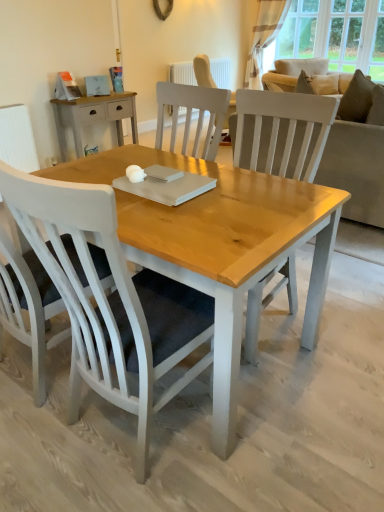
Question: Is white painted wood chair at left, the 1th chair viewed from the left, oriented away from light beige fabric couch at upper right?

Choices:
 (A) yes
 (B) no

Answer: (B)

Question: Is white painted wood chair at left, the 1th chair viewed from the left, positioned before light beige fabric couch at upper right?

Choices:
 (A) yes
 (B) no

Answer: (A)

Question: Is white painted wood chair at left, arranged as the 2th chair when viewed from the right, behind light beige fabric couch at upper right?

Choices:
 (A) yes
 (B) no

Answer: (B)

Question: From the image's perspective, would you say white painted wood chair at left, the 1th chair viewed from the left, is positioned over light beige fabric couch at upper right?

Choices:
 (A) yes
 (B) no

Answer: (B)

Question: Can you confirm if white painted wood chair at left, the 1th chair viewed from the left, is smaller than light beige fabric couch at upper right?

Choices:
 (A) yes
 (B) no

Answer: (A)

Question: Would you say white painted wood chair at left, the 1th chair viewed from the left, contains light beige fabric couch at upper right?

Choices:
 (A) yes
 (B) no

Answer: (B)

Question: Is striped fabric curtain at upper right taller than white painted wood chair at left, arranged as the 2th chair when viewed from the right?

Choices:
 (A) no
 (B) yes

Answer: (B)

Question: Is striped fabric curtain at upper right not inside white painted wood chair at left, arranged as the 2th chair when viewed from the right?

Choices:
 (A) no
 (B) yes

Answer: (B)

Question: Considering the relative sizes of striped fabric curtain at upper right and white painted wood chair at left, arranged as the 2th chair when viewed from the right, in the image provided, is striped fabric curtain at upper right wider than white painted wood chair at left, arranged as the 2th chair when viewed from the right,?

Choices:
 (A) yes
 (B) no

Answer: (B)

Question: Is striped fabric curtain at upper right turned away from white painted wood chair at left, arranged as the 2th chair when viewed from the right?

Choices:
 (A) no
 (B) yes

Answer: (A)

Question: From a real-world perspective, is striped fabric curtain at upper right positioned under white painted wood chair at left, arranged as the 2th chair when viewed from the right, based on gravity?

Choices:
 (A) no
 (B) yes

Answer: (A)

Question: Does striped fabric curtain at upper right appear on the right side of white painted wood chair at left, arranged as the 2th chair when viewed from the right?

Choices:
 (A) no
 (B) yes

Answer: (B)

Question: Considering the relative positions of white painted radiator at upper center and white painted wood chair at center, arranged as the 1th chair when viewed from the right, in the image provided, is white painted radiator at upper center to the left of white painted wood chair at center, arranged as the 1th chair when viewed from the right, from the viewer's perspective?

Choices:
 (A) no
 (B) yes

Answer: (A)